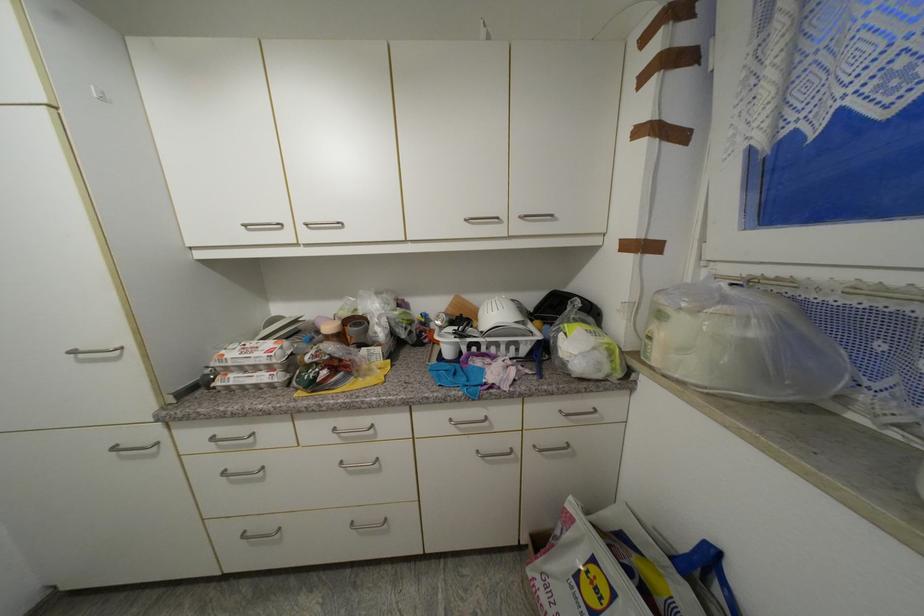
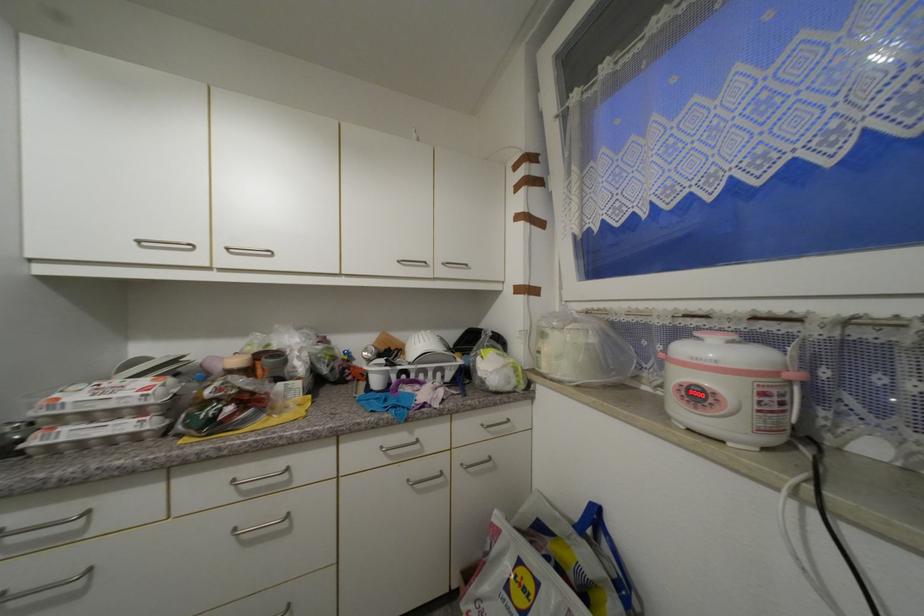
In the second image, find the point that corresponds to [470,222] in the first image.

(405, 262)